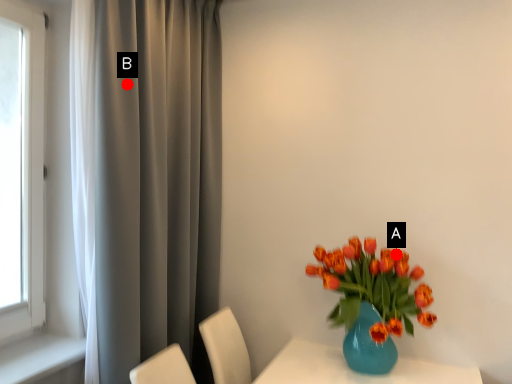
Question: Two points are circled on the image, labeled by A and B beside each circle. Which point appears closest to the camera in this image?

Choices:
 (A) A is closer
 (B) B is closer

Answer: (B)